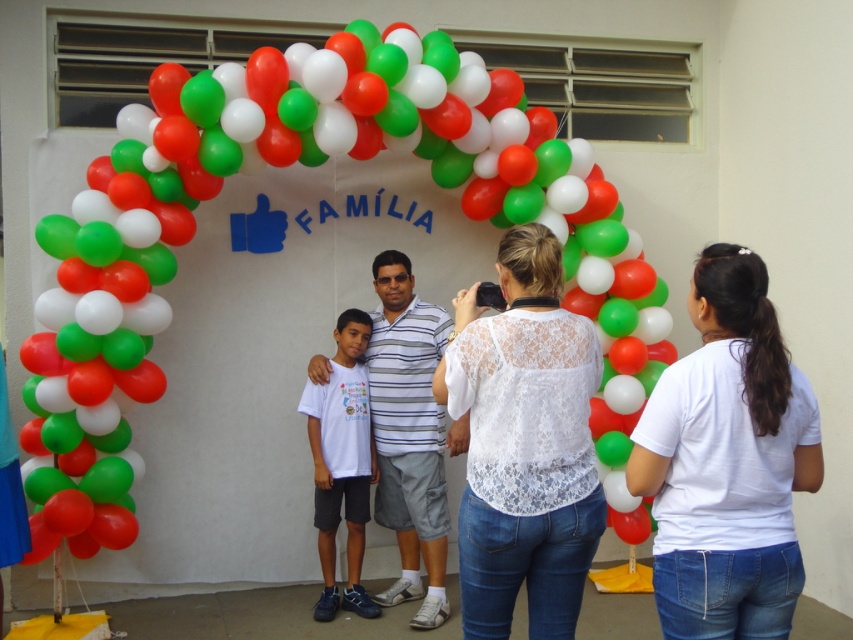
You are helping to organize a photo shoot and need to ensure that the clothing items are appropriately sized for the models. The scene has a white lace shirt at center and a white lace blouse at center. Which clothing item is more suitable for a smaller model?

The white lace shirt at center is smaller than the white lace blouse at center, so it would be more suitable for a smaller model.

Looking at this image, you are at a family celebration and want to take a photo with the white lace shirt at center. If you are standing 2.75 meters away, is this a comfortable distance for a group photo?

The distance between you and the white lace shirt at center is 2.75 meters, which is a comfortable distance for a group photo as it allows everyone to fit in the frame without being too cramped.